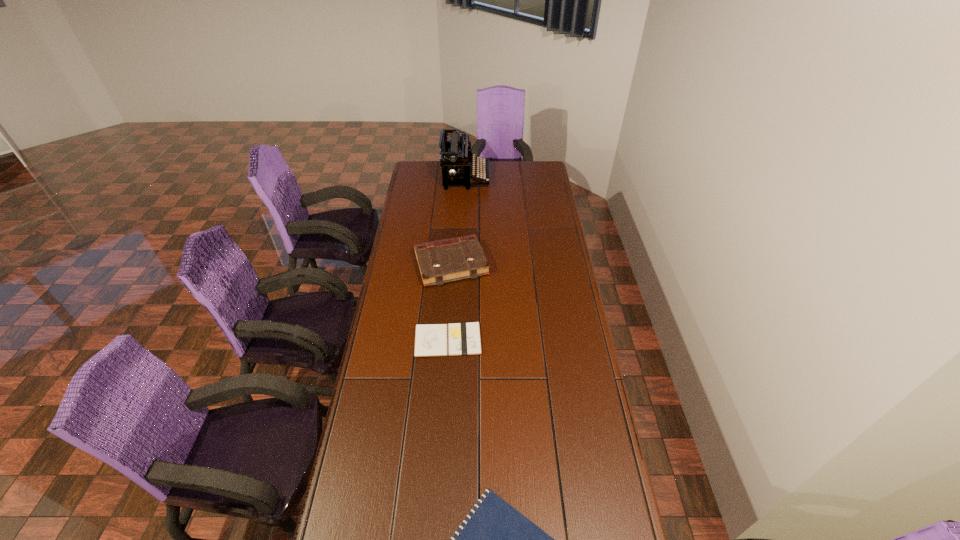
Locate an element on the screen. notepad that is at the left edge is located at coordinates (431, 340).

You are a GUI agent. You are given a task and a screenshot of the screen. Output one action in this format:
    pyautogui.click(x=<x>, y=<y>)
    Task: Click on the vacant region at the left edge of the desktop
    The width and height of the screenshot is (960, 540).
    Given the screenshot: What is the action you would take?
    pyautogui.click(x=401, y=284)

In the image, there is a desktop. Find the location of `vacant space at the right edge`. vacant space at the right edge is located at coordinates (538, 186).

The height and width of the screenshot is (540, 960). I want to click on free space at the far left corner, so point(414,174).

The height and width of the screenshot is (540, 960). What are the coordinates of `free area in between the second farthest object and the farthest object` in the screenshot? It's located at (459, 220).

This screenshot has width=960, height=540. I want to click on free spot between the third nearest object and the tallest object, so click(x=459, y=220).

Choose which object is the third nearest neighbor to the nearest object. Please provide its 2D coordinates. Your answer should be formatted as a tuple, i.e. [(x, y)], where the tuple contains the x and y coordinates of a point satisfying the conditions above.

[(455, 155)]

Locate an element on the screen. Image resolution: width=960 pixels, height=540 pixels. object identified as the second closest to the third nearest object is located at coordinates (455, 155).

What are the coordinates of `vacant point that satisfies the following two spatial constraints: 1. on the typing side of the tallest object; 2. on the front side of the second farthest object` in the screenshot? It's located at (462, 264).

Where is `free location that satisfies the following two spatial constraints: 1. on the typing side of the farthest object; 2. on the front side of the farther notepad`? free location that satisfies the following two spatial constraints: 1. on the typing side of the farthest object; 2. on the front side of the farther notepad is located at coordinates (459, 340).